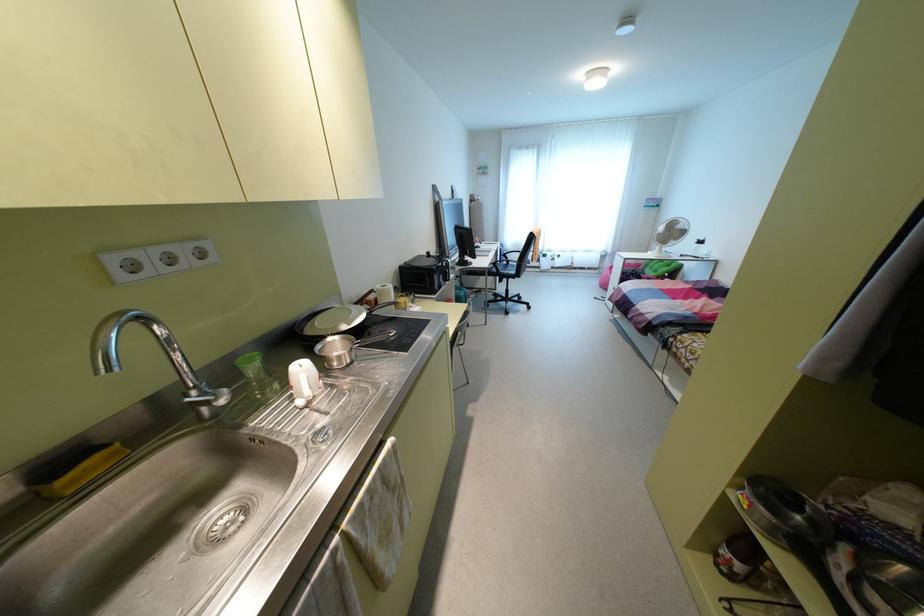
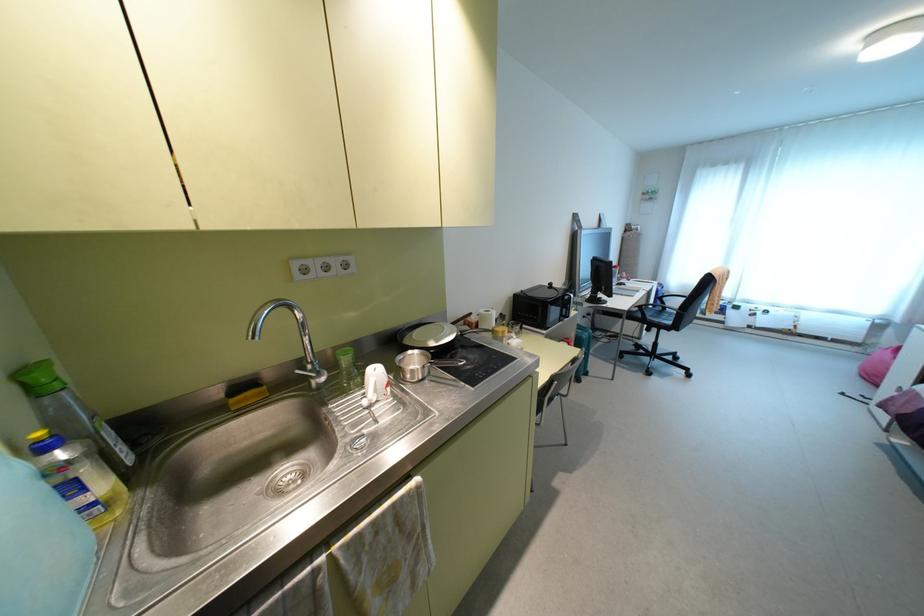
The point at [451,276] is marked in the first image. Where is the corresponding point in the second image?

(573, 313)